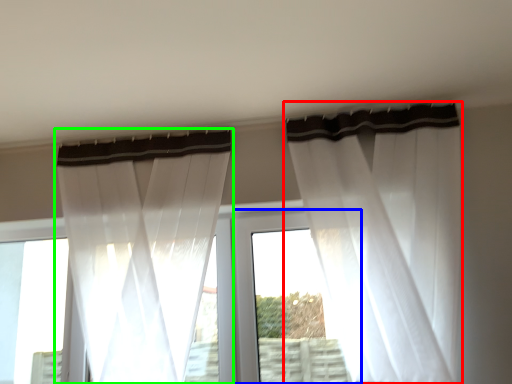
Question: Which object is positioned closest to curtain (highlighted by a red box)? Select from window frame (highlighted by a blue box) and curtain (highlighted by a green box).

Choices:
 (A) window frame
 (B) curtain

Answer: (A)